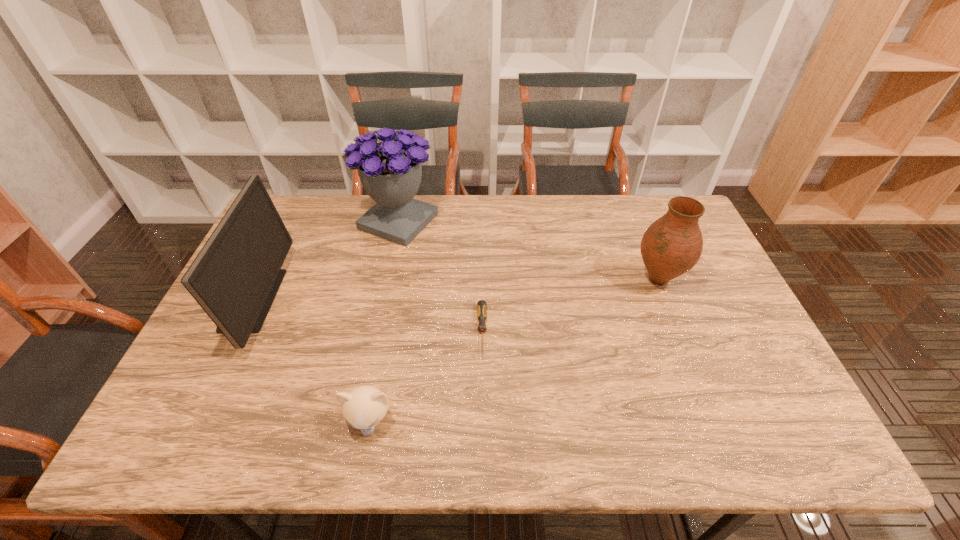
In the image, there is a desktop. Where is `vacant space at the near right corner`? The height and width of the screenshot is (540, 960). vacant space at the near right corner is located at coordinates (775, 432).

Where is `free space between the farthest object and the shortest object`? Image resolution: width=960 pixels, height=540 pixels. free space between the farthest object and the shortest object is located at coordinates (440, 276).

The height and width of the screenshot is (540, 960). I want to click on unoccupied position between the computer monitor and the bouquet, so click(324, 260).

You are a GUI agent. You are given a task and a screenshot of the screen. Output one action in this format:
    pyautogui.click(x=<x>, y=<y>)
    Task: Click on the vacant space in between the rightmost object and the kitten
    Image resolution: width=960 pixels, height=540 pixels.
    Given the screenshot: What is the action you would take?
    pyautogui.click(x=514, y=350)

Identify the location of free space between the vase and the bouquet. tap(528, 251).

At what (x,y) coordinates should I click in order to perform the action: click on free space between the fourth tallest object and the leftmost object. Please return your answer as a coordinate pair (x, y). The width and height of the screenshot is (960, 540). Looking at the image, I should click on (310, 360).

Where is `vacant space that's between the screwdriver and the vase`? Image resolution: width=960 pixels, height=540 pixels. vacant space that's between the screwdriver and the vase is located at coordinates (570, 305).

Find the location of a particular element. The image size is (960, 540). free space between the bouquet and the screwdriver is located at coordinates (440, 276).

Find the location of a particular element. free spot between the rightmost object and the shortest object is located at coordinates (570, 305).

You are a GUI agent. You are given a task and a screenshot of the screen. Output one action in this format:
    pyautogui.click(x=<x>, y=<y>)
    Task: Click on the empty location between the kitten and the vase
    This screenshot has width=960, height=540.
    Given the screenshot: What is the action you would take?
    pos(514,350)